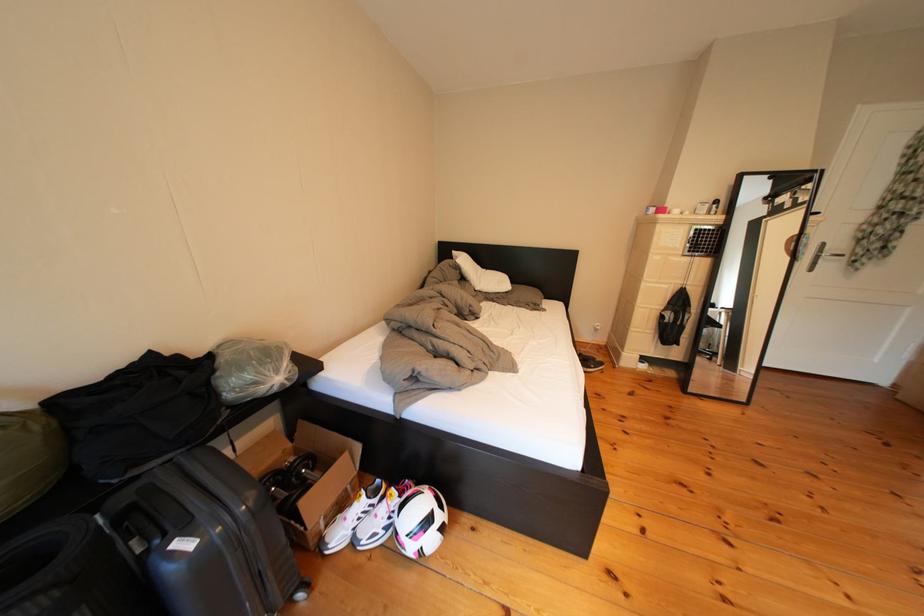
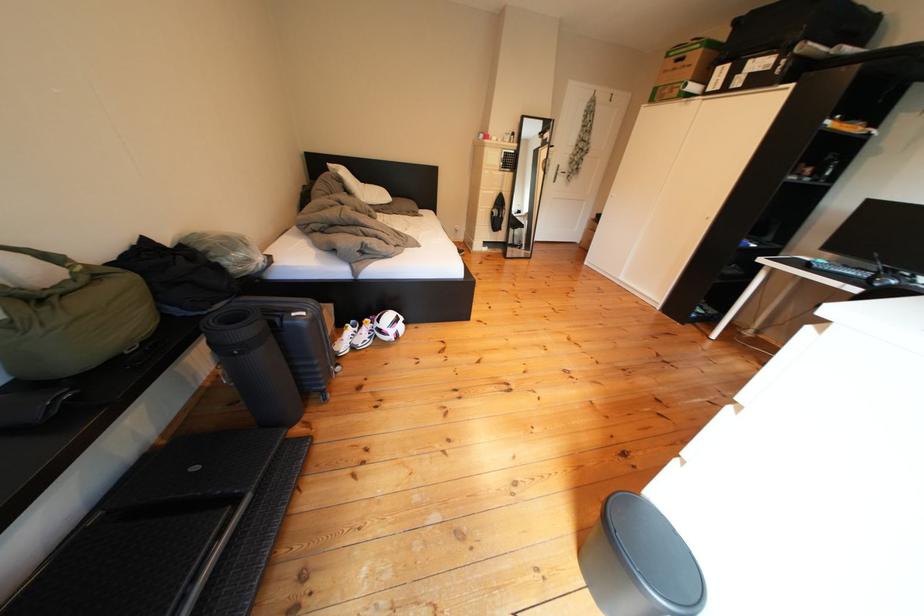
The point at (407, 495) is marked in the first image. Where is the corresponding point in the second image?

(381, 325)